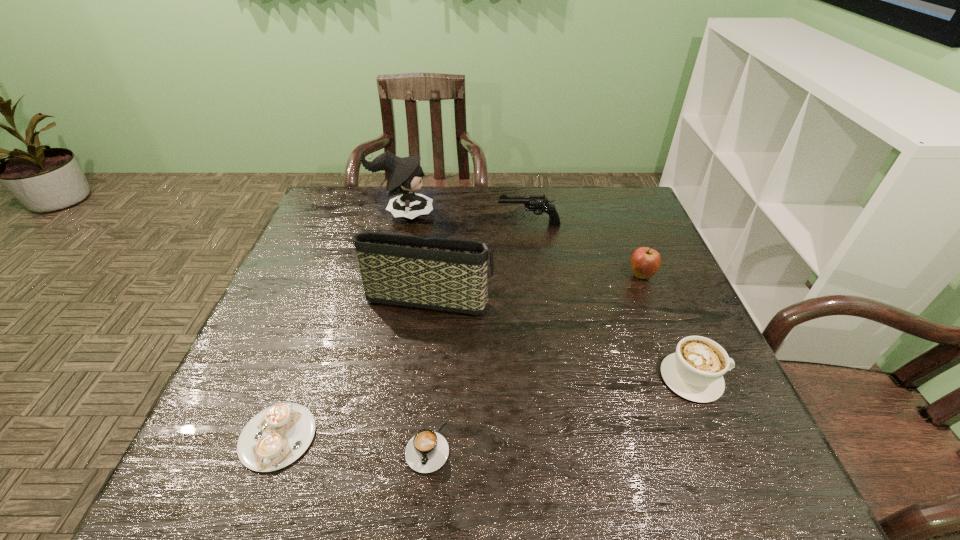
The height and width of the screenshot is (540, 960). In order to click on apple present at the right edge in this screenshot , I will do `click(645, 262)`.

Locate an element on the screen. This screenshot has height=540, width=960. cappuccino that is at the right edge is located at coordinates (695, 372).

This screenshot has height=540, width=960. Identify the location of object that is at the near left corner. [277, 436].

Find the location of a particular element. blank space at the far edge of the desktop is located at coordinates (373, 220).

Image resolution: width=960 pixels, height=540 pixels. I want to click on free location at the near edge, so click(407, 478).

What are the coordinates of `vacant region at the left edge of the desktop` in the screenshot? It's located at (317, 320).

Locate an element on the screen. The height and width of the screenshot is (540, 960). vacant space at the right edge is located at coordinates (637, 279).

At what (x,y) coordinates should I click in order to perform the action: click on free region at the far left corner of the desktop. Please return your answer as a coordinate pair (x, y). The height and width of the screenshot is (540, 960). Looking at the image, I should click on (332, 220).

Identify the location of vacant space at the far right corner of the desktop. (621, 192).

Where is `blank region between the apple and the leftmost cappuccino`? This screenshot has height=540, width=960. blank region between the apple and the leftmost cappuccino is located at coordinates (460, 356).